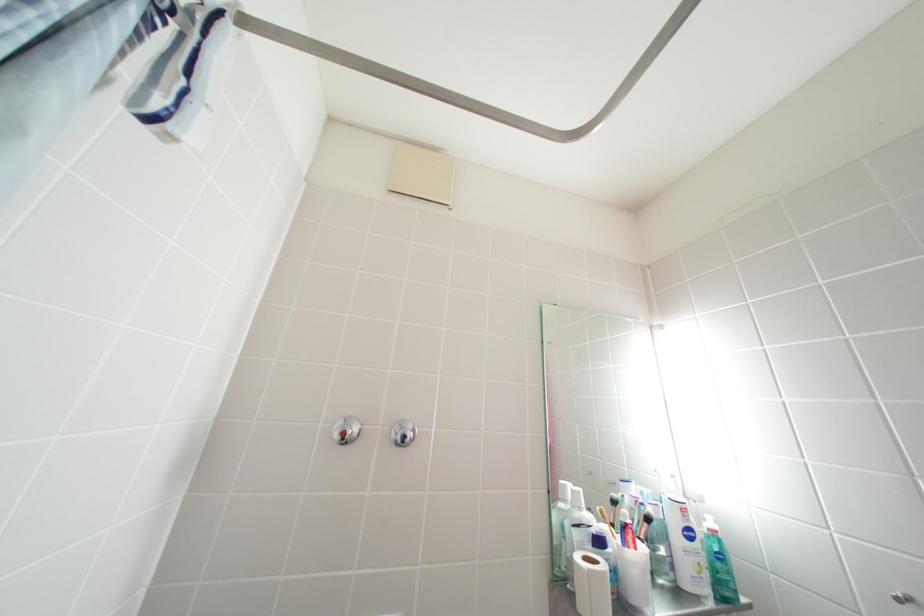
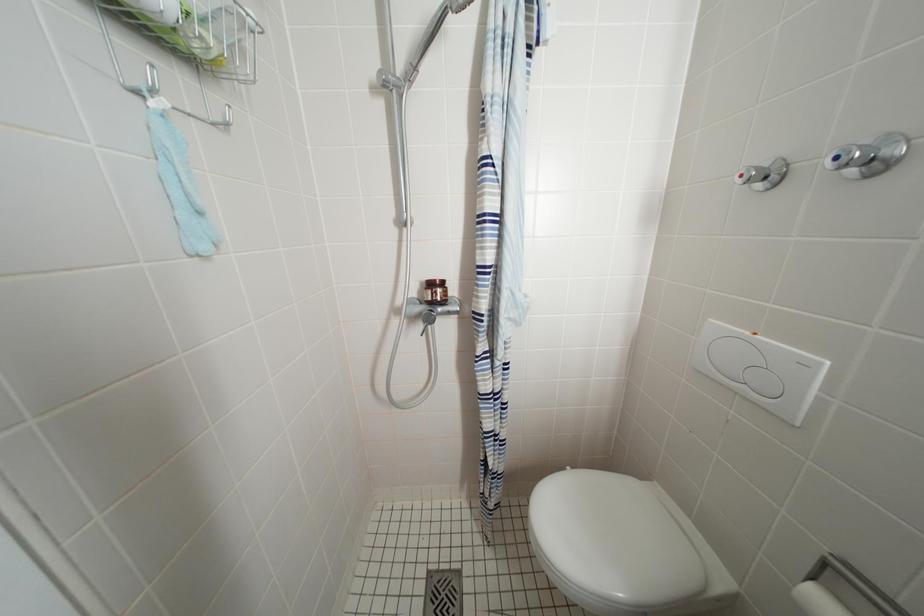
Question: The camera is either moving clockwise (left) or counter-clockwise (right) around the object. The first image is from the beginning of the video and the second image is from the end. Is the camera moving left or right when shooting the video?

Choices:
 (A) Left
 (B) Right

Answer: (B)